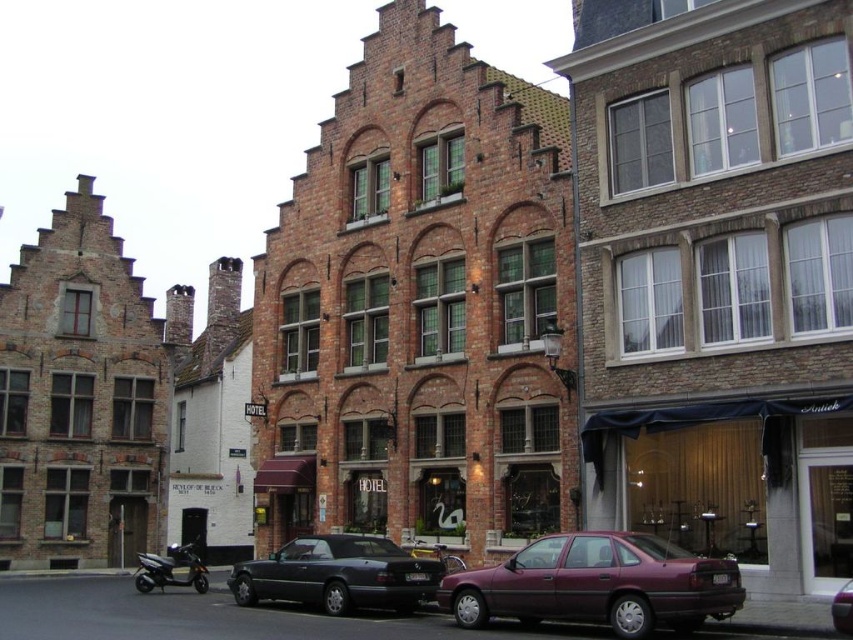
Question: Is shiny black convertible at center thinner than metallic maroon sedan at center?

Choices:
 (A) yes
 (B) no

Answer: (B)

Question: Observing the image, what is the correct spatial positioning of shiny black convertible at center in reference to metallic maroon sedan at center?

Choices:
 (A) left
 (B) right

Answer: (A)

Question: Which object is closer to the camera taking this photo?

Choices:
 (A) shiny black convertible at center
 (B) shiny black scooter at lower left

Answer: (A)

Question: Which object is the farthest from the maroon metallic car at lower right?

Choices:
 (A) metallic maroon sedan at center
 (B) shiny black convertible at center

Answer: (B)

Question: Which point appears closest to the camera in this image?

Choices:
 (A) (190, 540)
 (B) (848, 609)

Answer: (B)

Question: Is shiny black scooter at lower left to the right of metallic maroon sedan at center from the viewer's perspective?

Choices:
 (A) no
 (B) yes

Answer: (A)